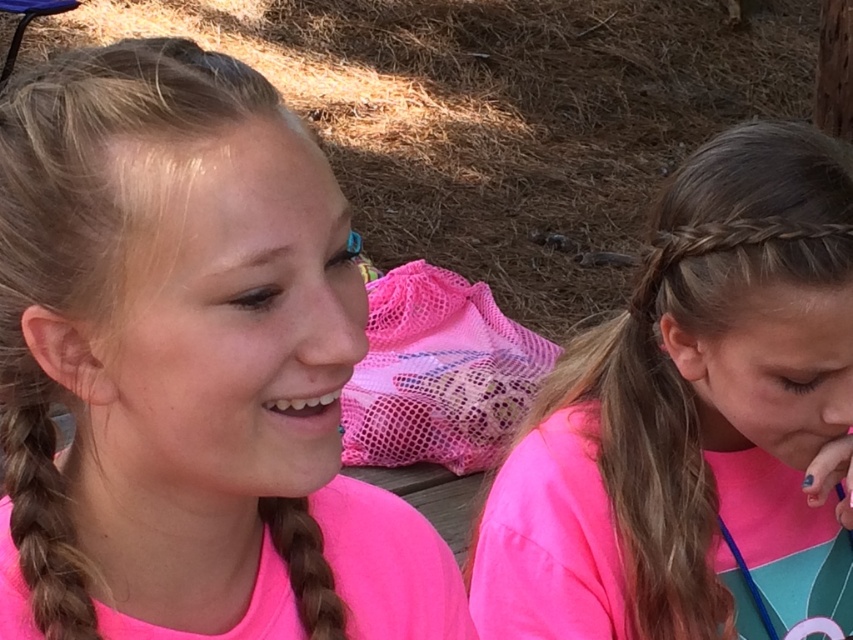
Question: Does brownhairponytail at left appear over brown silky hair at center?

Choices:
 (A) no
 (B) yes

Answer: (B)

Question: Considering the relative positions of pink matte shirt at left and brown silky hair at center in the image provided, where is pink matte shirt at left located with respect to brown silky hair at center?

Choices:
 (A) left
 (B) right

Answer: (A)

Question: Estimate the real-world distances between objects in this image. Which object is closer to the pink matte shirt at left?

Choices:
 (A) brownhairponytail at left
 (B) brown silky hair at center
 (C) pink fabric shirt at right

Answer: (A)

Question: Which point is farther from the camera taking this photo?

Choices:
 (A) (77, 634)
 (B) (160, 593)
 (C) (320, 579)
 (D) (633, 406)

Answer: (D)

Question: Can you confirm if pink matte shirt at left is wider than brownhairponytail at left?

Choices:
 (A) yes
 (B) no

Answer: (A)

Question: Which of the following is the closest to the observer?

Choices:
 (A) brownhairponytail at left
 (B) pink matte shirt at left

Answer: (B)